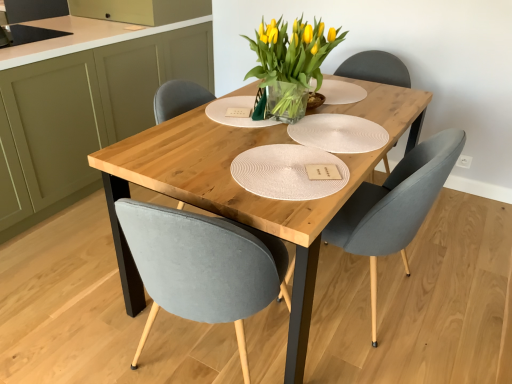
This screenshot has height=384, width=512. Identify the location of free spot to the right of velvet grey chair at center. 458,298.